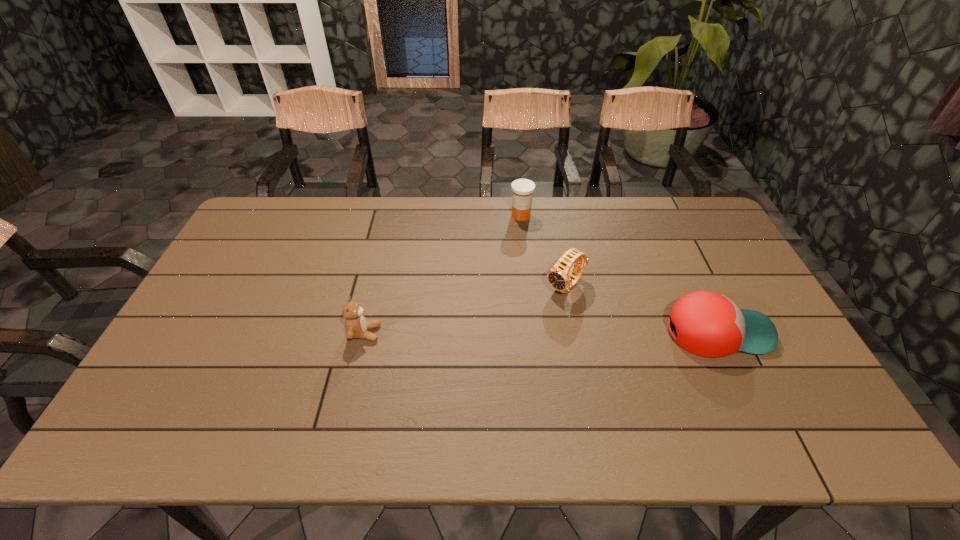
Find the location of `teddy bear`. teddy bear is located at coordinates (356, 326).

You are a GUI agent. You are given a task and a screenshot of the screen. Output one action in this format:
    pyautogui.click(x=<x>, y=<y>)
    Task: Click on the baseball cap
    The height and width of the screenshot is (540, 960).
    Given the screenshot: What is the action you would take?
    pyautogui.click(x=708, y=324)

Find the location of a particular element. The image size is (960, 540). watch is located at coordinates (559, 277).

Where is `the third object from left to right`? the third object from left to right is located at coordinates (559, 277).

I want to click on the second object from left to right, so click(523, 189).

You are a GUI agent. You are given a task and a screenshot of the screen. Output one action in this format:
    pyautogui.click(x=<x>, y=<y>)
    Task: Click on the medicine
    The image size is (960, 540).
    Given the screenshot: What is the action you would take?
    click(523, 189)

You are a GUI agent. You are given a task and a screenshot of the screen. Output one action in this format:
    pyautogui.click(x=<x>, y=<y>)
    Task: Click on the blank space located on the front-facing side of the leftmost object
    
    Given the screenshot: What is the action you would take?
    click(x=516, y=333)

The image size is (960, 540). I want to click on blank space located on the face of the second object from right to left, so click(527, 321).

What are the coordinates of `vacant space situated 0.290m on the face of the second object from right to left` in the screenshot? It's located at (486, 359).

Where is `vacant space located on the face of the second object from right to left`? The width and height of the screenshot is (960, 540). vacant space located on the face of the second object from right to left is located at coordinates (475, 368).